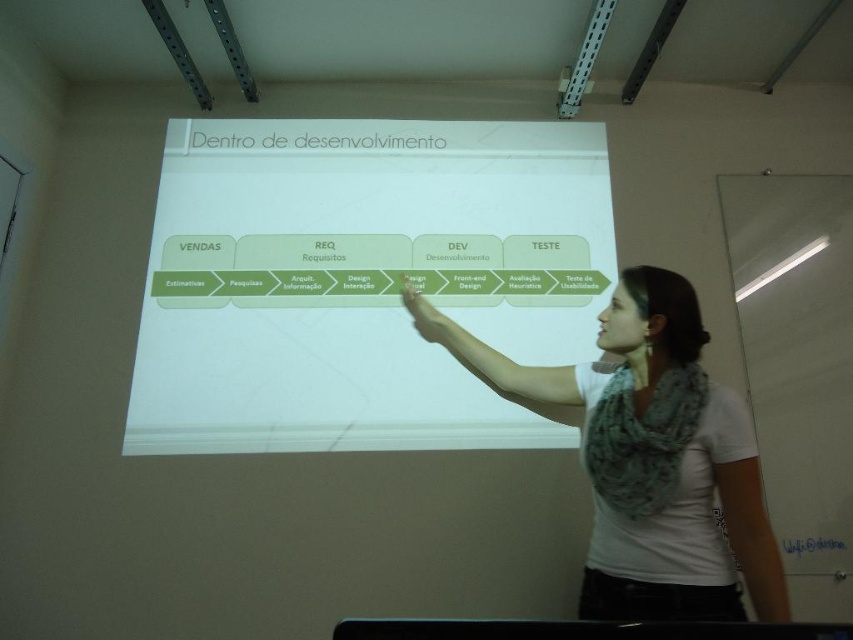
You are an attendee at the presentation and want to take a photo of the white matte projection screen at center and the white fabric scarf at upper right. Which object should you focus on first if you want to capture both in a single frame without moving the camera?

You should focus on the white matte projection screen at center first because it is wider than the white fabric scarf at upper right, so it will require more space in the frame. By centering the screen and adjusting the camera angle to include the scarf, both objects can be captured without moving the camera.

You are an attendee sitting in the front row of the classroom. You notice the white fabric scarf at upper right and the white matte projection screen at center. Which object is closer to you?

The white matte projection screen at center is closer to you because the white fabric scarf at upper right is behind it.